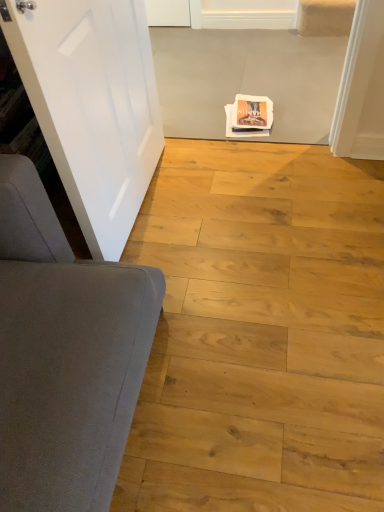
Locate an element on the screen. Image resolution: width=384 pixels, height=512 pixels. vacant space in front of white matte door at left is located at coordinates (184, 273).